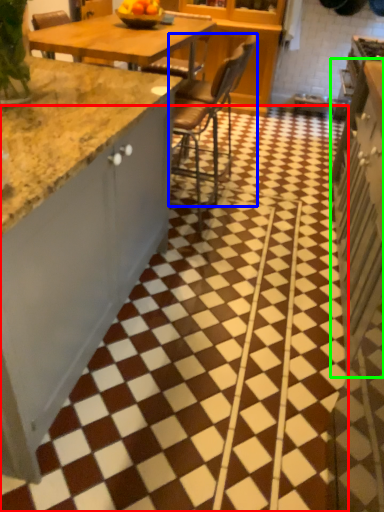
Question: Considering the real-world distances, which object is farthest from tile (highlighted by a red box)? chair (highlighted by a blue box) or cabinetry (highlighted by a green box)?

Choices:
 (A) chair
 (B) cabinetry

Answer: (A)